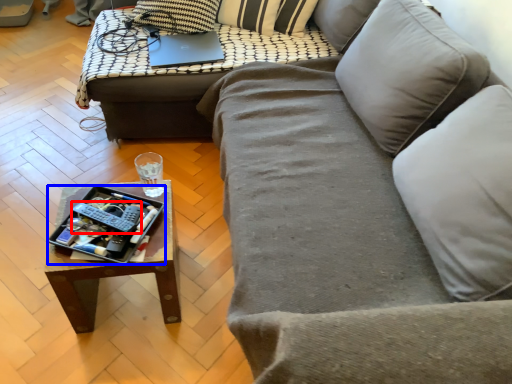
Question: Which of the following is the farthest to the observer, remote (highlighted by a red box) or tray (highlighted by a blue box)?

Choices:
 (A) remote
 (B) tray

Answer: (A)